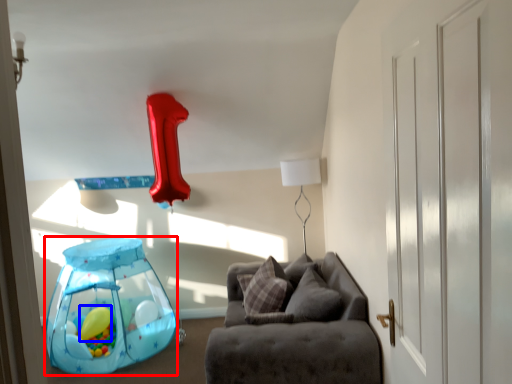
Question: Among these objects, which one is nearest to the camera, balloon (highlighted by a red box) or balloon (highlighted by a blue box)?

Choices:
 (A) balloon
 (B) balloon

Answer: (A)